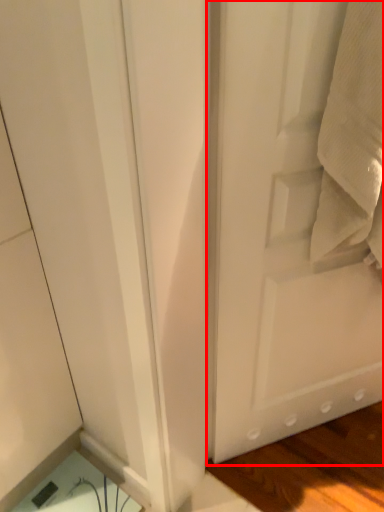
Question: Where is door (annotated by the red box) located in relation to bath towel in the image?

Choices:
 (A) left
 (B) right

Answer: (B)